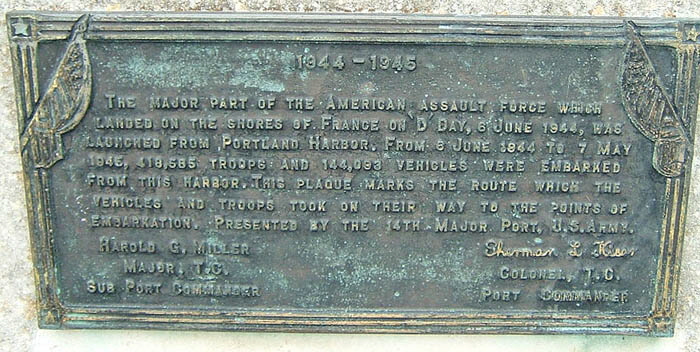
Locate an element on the screen. This screenshot has height=352, width=700. bottom side of frame around plaque is located at coordinates (360, 320).